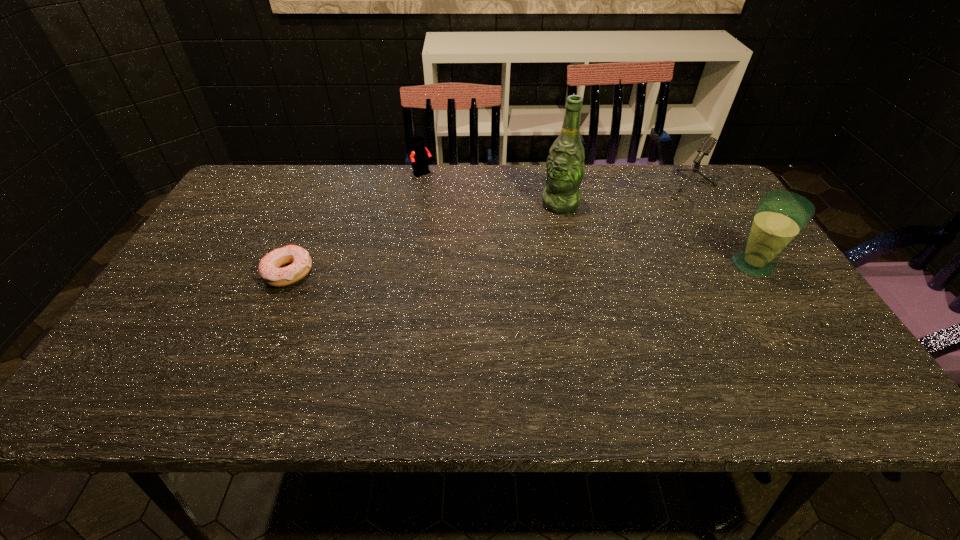
At what (x,y) coordinates should I click in order to perform the action: click on beer bottle at the far edge. Please return your answer as a coordinate pair (x, y). The height and width of the screenshot is (540, 960). Looking at the image, I should click on (565, 165).

Where is `glass located in the right edge section of the desktop`? glass located in the right edge section of the desktop is located at coordinates (780, 216).

The width and height of the screenshot is (960, 540). What are the coordinates of `microphone present at the right edge` in the screenshot? It's located at (706, 147).

This screenshot has height=540, width=960. I want to click on object that is at the far right corner, so click(x=706, y=147).

Identify the location of vacant area at the far edge. (497, 192).

Locate an element on the screen. vacant area at the near edge is located at coordinates (508, 354).

Identify the location of free location at the left edge of the desktop. This screenshot has height=540, width=960. (178, 329).

Find the location of a particular element. free space at the right edge of the desktop is located at coordinates (789, 298).

In order to click on blank space at the far left corner of the desktop in this screenshot , I will do `click(263, 185)`.

Locate an element on the screen. vacant space at the near left corner of the desktop is located at coordinates (131, 359).